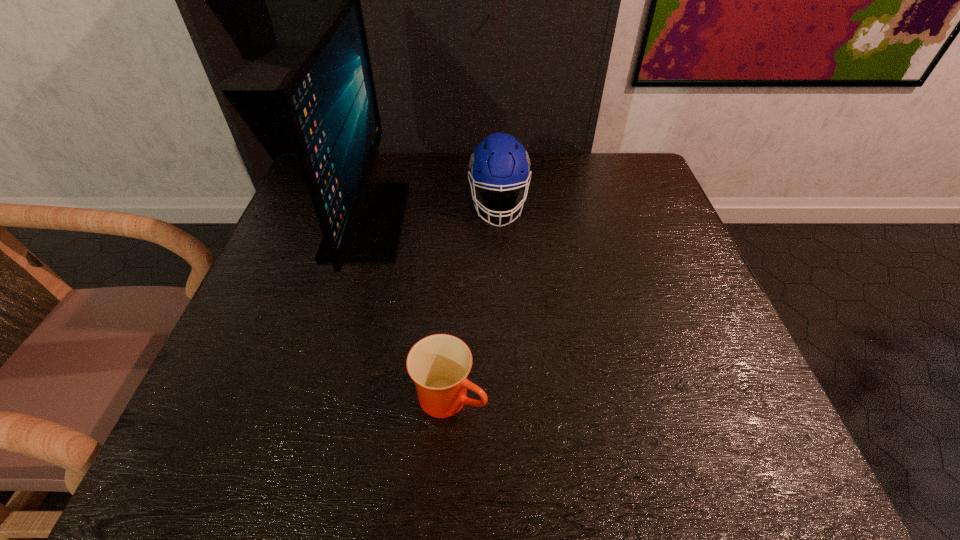
Find the location of a particular element. The height and width of the screenshot is (540, 960). object located in the near edge section of the desktop is located at coordinates pyautogui.click(x=439, y=364).

Where is `object located in the left edge section of the desktop`? The width and height of the screenshot is (960, 540). object located in the left edge section of the desktop is located at coordinates click(x=328, y=98).

Where is `object that is positioned at the far left corner`? object that is positioned at the far left corner is located at coordinates (328, 98).

I want to click on blank space at the far edge, so click(529, 194).

The image size is (960, 540). Find the location of `free region at the near edge`. free region at the near edge is located at coordinates (588, 442).

Find the location of a particular element. vacant space at the left edge is located at coordinates (311, 285).

Locate an element on the screen. Image resolution: width=960 pixels, height=540 pixels. free region at the right edge of the desktop is located at coordinates (626, 220).

In the image, there is a desktop. Identify the location of free space at the near left corner. This screenshot has width=960, height=540. (198, 433).

This screenshot has height=540, width=960. In the image, there is a desktop. Find the location of `vacant region at the near right corner`. vacant region at the near right corner is located at coordinates (727, 460).

This screenshot has width=960, height=540. What are the coordinates of `free space between the nearest object and the football helmet` in the screenshot? It's located at [474, 301].